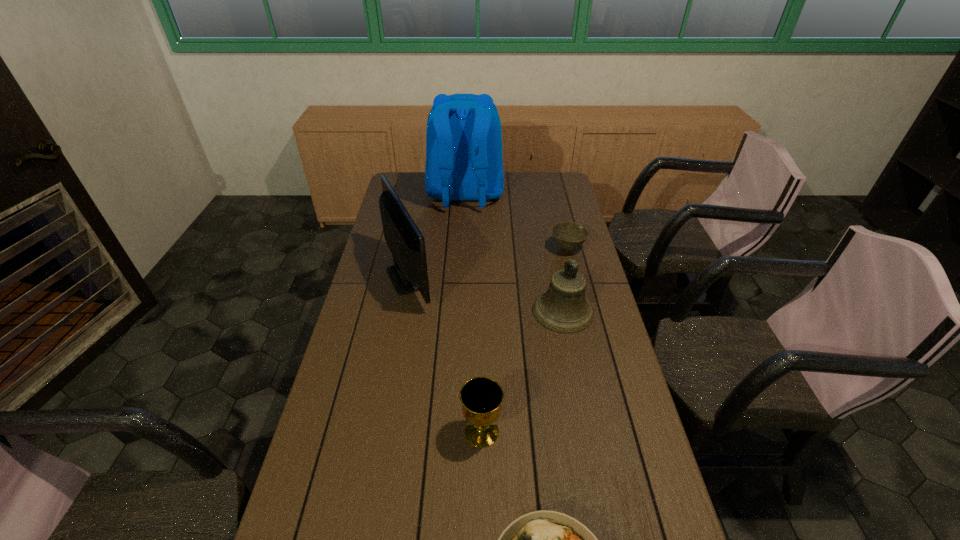
This screenshot has width=960, height=540. I want to click on vacant point that satisfies the following two spatial constraints: 1. on the back side of the fourth shortest object; 2. on the front-facing side of the computer monitor, so click(556, 277).

Locate an element on the screen. Image resolution: width=960 pixels, height=540 pixels. blank space that satisfies the following two spatial constraints: 1. on the back of the bowl; 2. on the left side of the backpack is located at coordinates (463, 248).

At what (x,y) coordinates should I click in order to perform the action: click on free space that satisfies the following two spatial constraints: 1. on the back of the farthest object; 2. on the right side of the third tallest object. Please return your answer as a coordinate pair (x, y). This screenshot has height=540, width=960. Looking at the image, I should click on (460, 311).

Where is `free region that satisfies the following two spatial constraints: 1. on the back of the bell; 2. on the left side of the tallest object`? This screenshot has height=540, width=960. free region that satisfies the following two spatial constraints: 1. on the back of the bell; 2. on the left side of the tallest object is located at coordinates (460, 311).